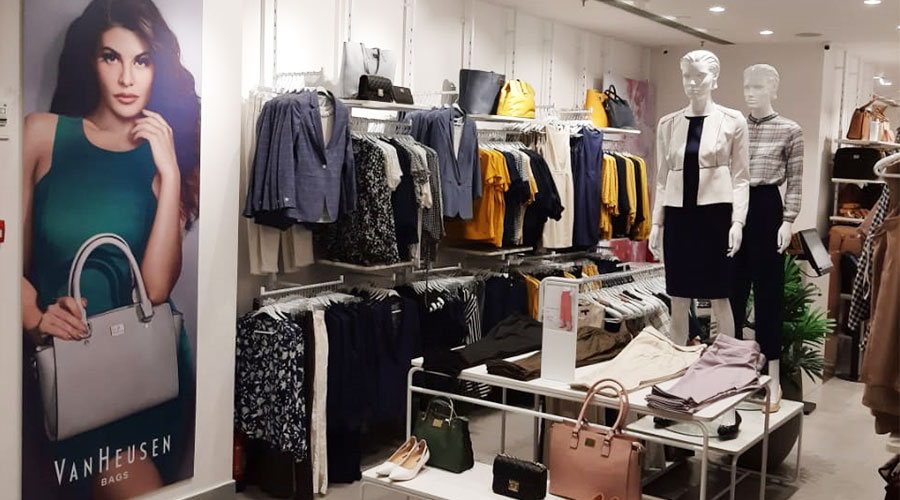
Find the location of a particular element. display table is located at coordinates (743, 420).